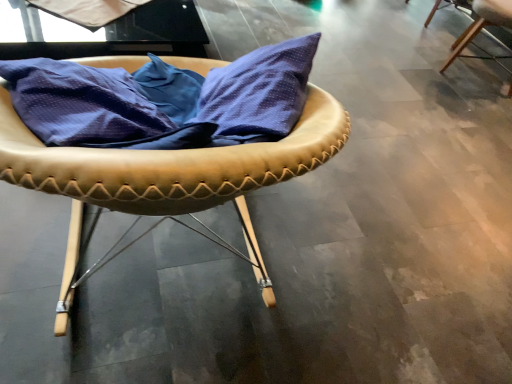
Question: Should I look upward or downward to see white matte fabric at upper left?

Choices:
 (A) up
 (B) down

Answer: (A)

Question: Is the surface of leather-like tan chair at center, which ranks as the first chair in left-to-right order, in direct contact with white matte fabric at upper left?

Choices:
 (A) yes
 (B) no

Answer: (B)

Question: Does leather-like tan chair at center, the 2th chair positioned from the top, contain white matte fabric at upper left?

Choices:
 (A) yes
 (B) no

Answer: (B)

Question: Does leather-like tan chair at center, the 2th chair viewed from the back, lie in front of white matte fabric at upper left?

Choices:
 (A) yes
 (B) no

Answer: (A)

Question: Can you confirm if leather-like tan chair at center, positioned as the 1th chair in front-to-back order, is taller than white matte fabric at upper left?

Choices:
 (A) no
 (B) yes

Answer: (B)

Question: Considering the relative sizes of leather-like tan chair at center, placed as the 2th chair when sorted from right to left, and white matte fabric at upper left in the image provided, is leather-like tan chair at center, placed as the 2th chair when sorted from right to left, bigger than white matte fabric at upper left?

Choices:
 (A) no
 (B) yes

Answer: (B)

Question: From a real-world perspective, is leather-like tan chair at center, placed as the 2th chair when sorted from right to left, physically above white matte fabric at upper left?

Choices:
 (A) yes
 (B) no

Answer: (A)

Question: Could you tell me if white matte fabric at upper left is facing leather-like tan chair at center, the 2th chair positioned from the top?

Choices:
 (A) yes
 (B) no

Answer: (B)

Question: From the image's perspective, does white matte fabric at upper left appear higher than leather-like tan chair at center, the 2th chair positioned from the top?

Choices:
 (A) no
 (B) yes

Answer: (B)

Question: Is leather-like tan chair at center, positioned as the 1th chair in front-to-back order, inside white matte fabric at upper left?

Choices:
 (A) no
 (B) yes

Answer: (A)

Question: Is white matte fabric at upper left to the left of leather-like tan chair at center, the 2th chair positioned from the top, from the viewer's perspective?

Choices:
 (A) no
 (B) yes

Answer: (B)

Question: Is white matte fabric at upper left further to the viewer compared to leather-like tan chair at center, the 2th chair viewed from the back?

Choices:
 (A) no
 (B) yes

Answer: (B)

Question: Is white matte fabric at upper left bigger than leather-like tan chair at center, the 2th chair positioned from the top?

Choices:
 (A) yes
 (B) no

Answer: (B)

Question: Does white matte fabric at upper left have a lesser height compared to light brown leather chair at upper right, which appears as the 2th chair when viewed from the front?

Choices:
 (A) yes
 (B) no

Answer: (A)